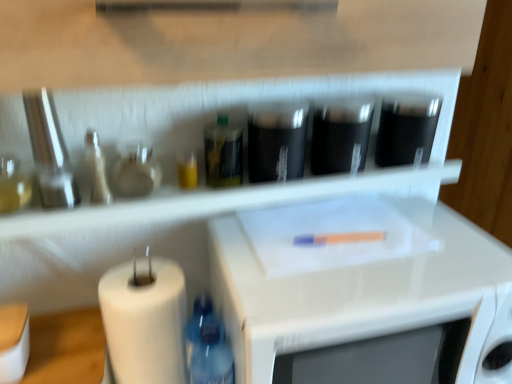
Locate an element on the screen. free space in front of translucent glass bottle at center, the 3th bottle ordered from the bottom is located at coordinates [x=211, y=200].